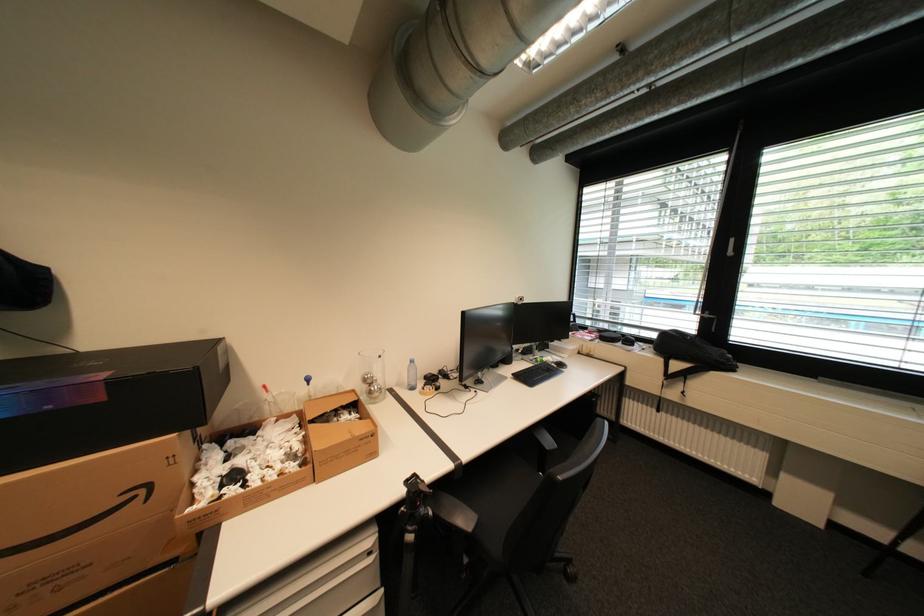
Where would you lift the glass container? Please return your answer as a coordinate pair (x, y).

(371, 375)